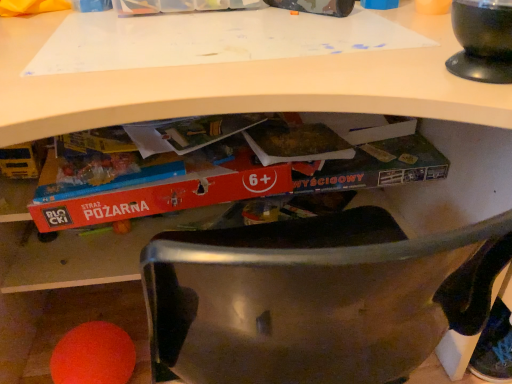
Question: Is black glossy bowl at upper right taller or shorter than red cardboard book at center?

Choices:
 (A) tall
 (B) short

Answer: (B)

Question: Does point (476, 11) appear closer or farther from the camera than point (233, 187)?

Choices:
 (A) farther
 (B) closer

Answer: (B)

Question: Based on their positions, is black glossy bowl at upper right located to the left or right of red cardboard book at center?

Choices:
 (A) right
 (B) left

Answer: (A)

Question: Choose the correct answer: Is red cardboard book at center inside black glossy bowl at upper right or outside it?

Choices:
 (A) inside
 (B) outside

Answer: (B)

Question: In terms of height, does red cardboard book at center look taller or shorter compared to black glossy bowl at upper right?

Choices:
 (A) short
 (B) tall

Answer: (B)

Question: Considering the positions of red cardboard book at center and black glossy bowl at upper right in the image, is red cardboard book at center wider or thinner than black glossy bowl at upper right?

Choices:
 (A) thin
 (B) wide

Answer: (B)

Question: From a real-world perspective, is red cardboard book at center physically located above or below black glossy bowl at upper right?

Choices:
 (A) above
 (B) below

Answer: (B)